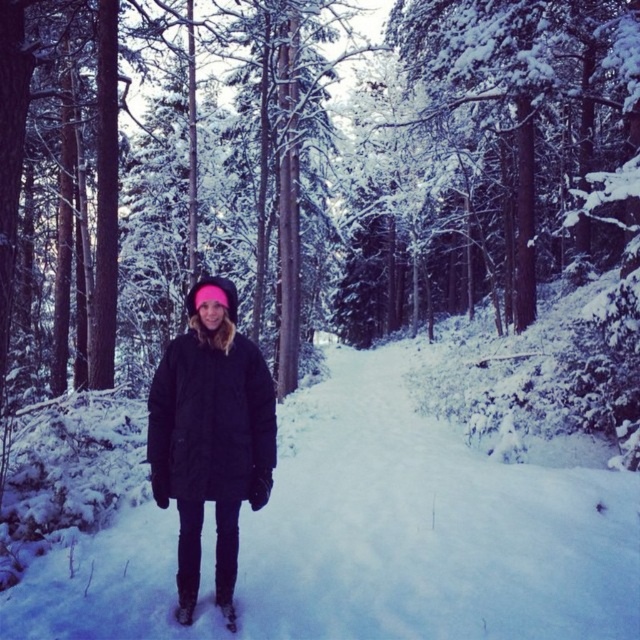
Consider the image. You are standing on the snow and want to take a photo of the black puffy coat at center. Since the white fluffy snow at center is in the way, can you still take the photo without moving the snow?

The white fluffy snow at center is further to the viewer than the black puffy coat at center, so the snow is between you and the coat. You would need to move the snow to take the photo without obstruction.

Consider the image. You are a photographer trying to capture the winter scene. You want to ensure that the white fluffy snow at center and the black puffy coat at center are both clearly visible in your photo. Given their sizes, which object should you focus on to ensure proper exposure?

The white fluffy snow at center has a larger size compared to the black puffy coat at center, so you should focus on the white fluffy snow at center to ensure proper exposure.